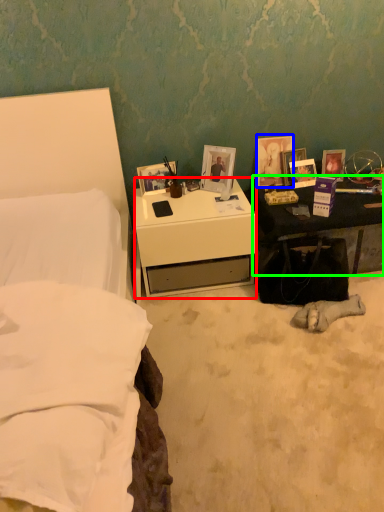
Question: Based on their relative distances, which object is nearer to desk (highlighted by a red box)? Choose from picture frame (highlighted by a blue box) and nightstand (highlighted by a green box).

Choices:
 (A) picture frame
 (B) nightstand

Answer: (B)